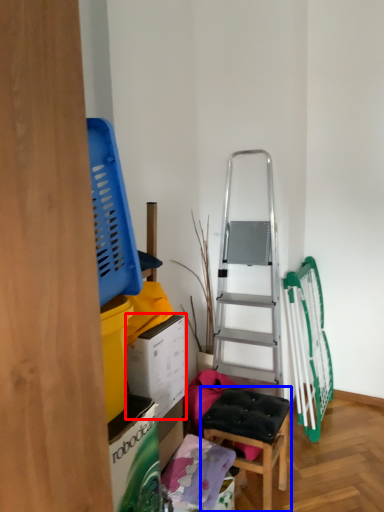
Question: Which of the following is the closest to the observer, box (highlighted by a red box) or furniture (highlighted by a blue box)?

Choices:
 (A) box
 (B) furniture

Answer: (A)